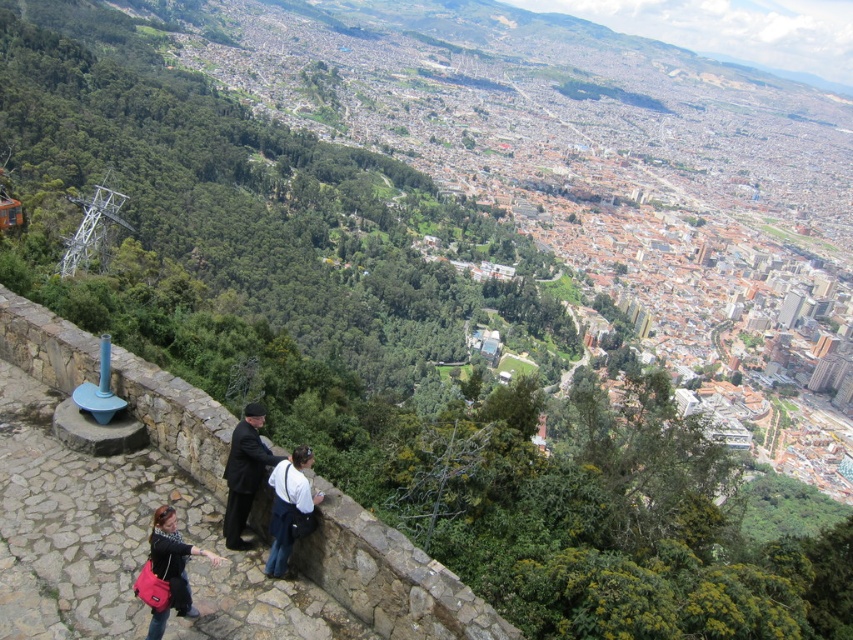
You are standing at the center of the stone pathway and want to reach the stone at lower left marked by point (390, 577). What direction should you move in?

Move towards the lower left direction to reach the stone at lower left marked by point (390, 577).

You are a photographer trying to capture a photo of the stone at lower left and the dark suit at center. Which object should you focus on first if you want to ensure both are in sharp focus?

A: The stone at lower left is bigger than the dark suit at center, so focusing on the stone at lower left first would help ensure both are in sharp focus as it requires a closer focus distance.

You are a photographer standing at the edge of the stone pathway and want to place your tripod. You see the stone at lower left and the matte black jacket at lower left. Which object should you avoid placing the tripod near to ensure stability?

You should avoid placing the tripod near the stone at lower left because it has a larger size compared to the matte black jacket at lower left, which means it occupies more space and might obstruct the tripod setup.